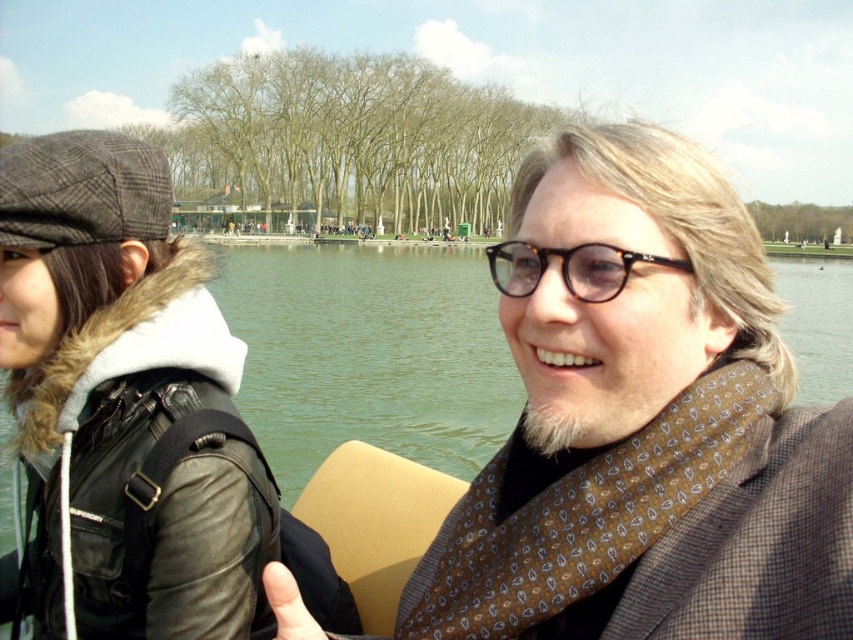
Question: Which object is closer to the camera taking this photo?

Choices:
 (A) leather jacket at left
 (B) green water at center
 (C) matte black jacket at left

Answer: (C)

Question: Does matte black jacket at left come in front of leather jacket at left?

Choices:
 (A) yes
 (B) no

Answer: (A)

Question: Is leather jacket at left to the right of tortoiseshell frame glasses at center from the viewer's perspective?

Choices:
 (A) no
 (B) yes

Answer: (A)

Question: Which point is closer to the camera?

Choices:
 (A) matte black jacket at left
 (B) green water at center

Answer: (A)

Question: Which point appears farthest from the camera in this image?

Choices:
 (A) (817, 573)
 (B) (469, 348)

Answer: (B)

Question: Can you confirm if matte black jacket at left is thinner than green water at center?

Choices:
 (A) yes
 (B) no

Answer: (A)